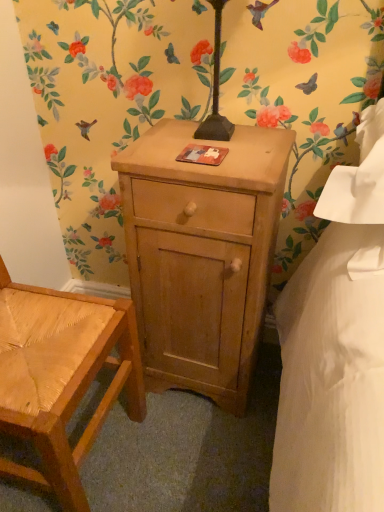
Question: From the image's perspective, relative to woven wood chair at lower left, is natural wood nightstand at center above or below?

Choices:
 (A) below
 (B) above

Answer: (B)

Question: Is point (124, 190) closer or farther from the camera than point (59, 398)?

Choices:
 (A) farther
 (B) closer

Answer: (A)

Question: From a real-world perspective, is natural wood nightstand at center above or below woven wood chair at lower left?

Choices:
 (A) below
 (B) above

Answer: (A)

Question: Is woven wood chair at lower left wider or thinner than natural wood nightstand at center?

Choices:
 (A) wide
 (B) thin

Answer: (A)

Question: From the image's perspective, is woven wood chair at lower left positioned above or below natural wood nightstand at center?

Choices:
 (A) above
 (B) below

Answer: (B)

Question: Would you say woven wood chair at lower left is to the left or to the right of natural wood nightstand at center in the picture?

Choices:
 (A) left
 (B) right

Answer: (A)

Question: In terms of height, does woven wood chair at lower left look taller or shorter compared to natural wood nightstand at center?

Choices:
 (A) tall
 (B) short

Answer: (A)